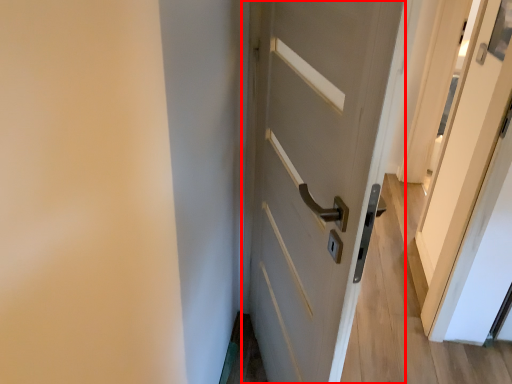
Question: From the image's perspective, where is door (annotated by the red box) located in relation to screen door in the image?

Choices:
 (A) below
 (B) above

Answer: (A)